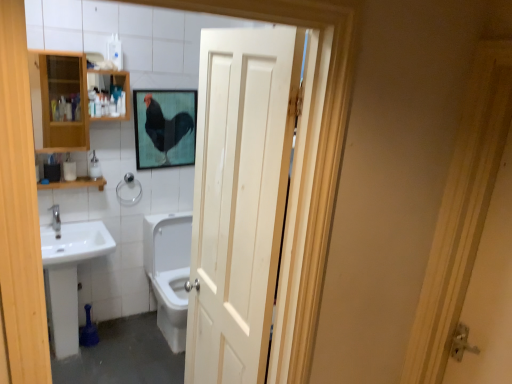
At what (x,y) coordinates should I click in order to perform the action: click on spots to the right of white glossy sink at left. Please return your answer as a coordinate pair (x, y). Looking at the image, I should click on (131, 349).